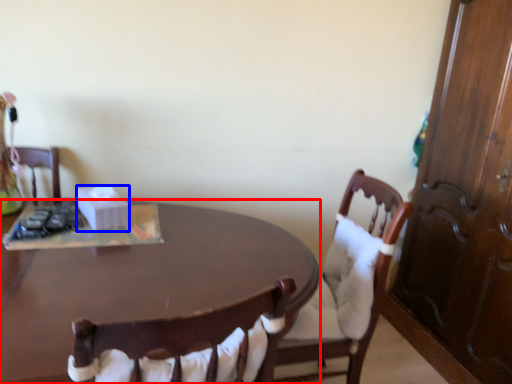
Question: Among these objects, which one is nearest to the camera, desk (highlighted by a red box) or box (highlighted by a blue box)?

Choices:
 (A) desk
 (B) box

Answer: (A)